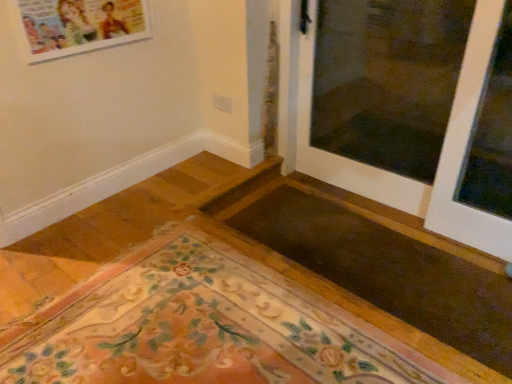
Question: Is floral carpet at lower left thinner than transparent glass window at right?

Choices:
 (A) no
 (B) yes

Answer: (A)

Question: From the image's perspective, would you say floral carpet at lower left is positioned over transparent glass window at right?

Choices:
 (A) yes
 (B) no

Answer: (B)

Question: Considering the relative sizes of floral carpet at lower left and transparent glass window at right in the image provided, is floral carpet at lower left bigger than transparent glass window at right?

Choices:
 (A) no
 (B) yes

Answer: (B)

Question: Does floral carpet at lower left appear on the right side of transparent glass window at right?

Choices:
 (A) no
 (B) yes

Answer: (A)

Question: Considering the relative sizes of floral carpet at lower left and transparent glass window at right in the image provided, is floral carpet at lower left wider than transparent glass window at right?

Choices:
 (A) no
 (B) yes

Answer: (B)

Question: Is floral carpet at lower left shorter than transparent glass window at right?

Choices:
 (A) no
 (B) yes

Answer: (B)

Question: Does floral carpet at lower left have a smaller size compared to white glossy door at upper right?

Choices:
 (A) no
 (B) yes

Answer: (B)

Question: From a real-world perspective, does floral carpet at lower left sit lower than white glossy door at upper right?

Choices:
 (A) yes
 (B) no

Answer: (A)

Question: Does floral carpet at lower left appear on the left side of white glossy door at upper right?

Choices:
 (A) no
 (B) yes

Answer: (B)

Question: Is floral carpet at lower left to the right of white glossy door at upper right from the viewer's perspective?

Choices:
 (A) no
 (B) yes

Answer: (A)

Question: Are floral carpet at lower left and white glossy door at upper right far apart?

Choices:
 (A) no
 (B) yes

Answer: (B)

Question: Can you confirm if floral carpet at lower left is taller than white glossy door at upper right?

Choices:
 (A) yes
 (B) no

Answer: (B)

Question: Is white glossy door at upper right next to transparent glass window at right and touching it?

Choices:
 (A) yes
 (B) no

Answer: (B)